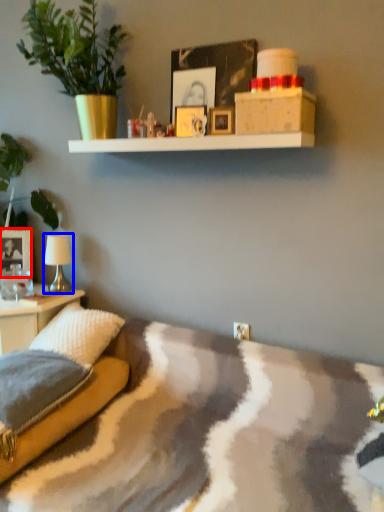
Question: Which object is closer to the camera taking this photo, picture frame (highlighted by a red box) or table lamp (highlighted by a blue box)?

Choices:
 (A) picture frame
 (B) table lamp

Answer: (B)